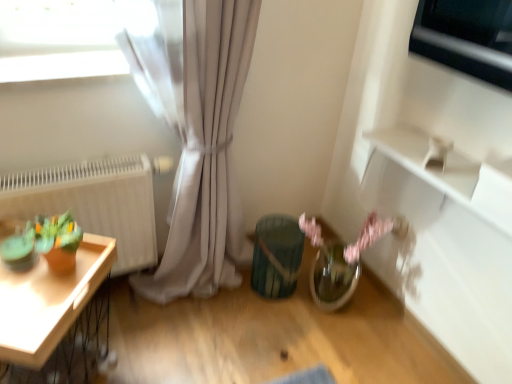
Locate an element on the screen. vacant space to the left of teal textured vase at center is located at coordinates (226, 291).